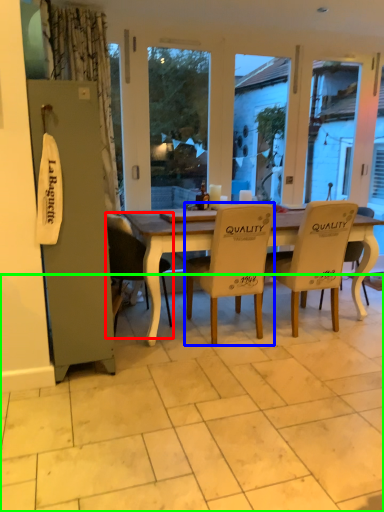
Question: Considering the real-world distances, which object is closest to chair (highlighted by a red box)? chair (highlighted by a blue box) or tile (highlighted by a green box).

Choices:
 (A) chair
 (B) tile

Answer: (A)